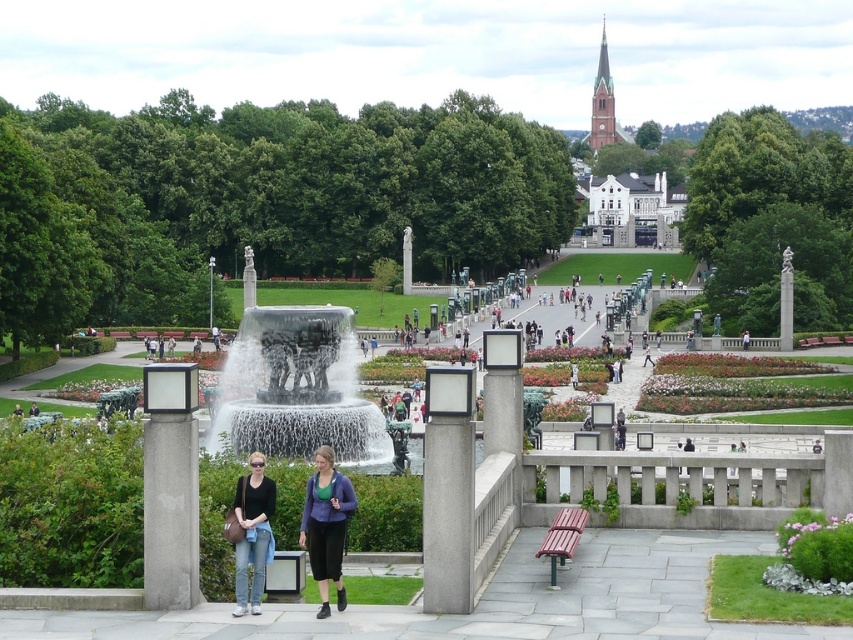
Question: Among these points, which one is farthest from the camera?

Choices:
 (A) (242, 604)
 (B) (305, 330)
 (C) (570, 547)
 (D) (311, 499)

Answer: (B)

Question: Which point is closer to the camera taking this photo?

Choices:
 (A) (303, 442)
 (B) (326, 474)
 (C) (331, 508)

Answer: (C)

Question: Which of the following is the closest to the observer?

Choices:
 (A) (305, 445)
 (B) (791, 460)
 (C) (334, 531)
 (D) (567, 515)

Answer: (C)

Question: Does matte black jacket at center come in front of wooden bench at lower center?

Choices:
 (A) yes
 (B) no

Answer: (B)

Question: Considering the relative positions of denim jeans at lower left and wooden bench at lower center in the image provided, where is denim jeans at lower left located with respect to wooden bench at lower center?

Choices:
 (A) above
 (B) below

Answer: (B)

Question: Can you confirm if translucent glass water at center is positioned to the left of matte purple sweater at center?

Choices:
 (A) no
 (B) yes

Answer: (B)